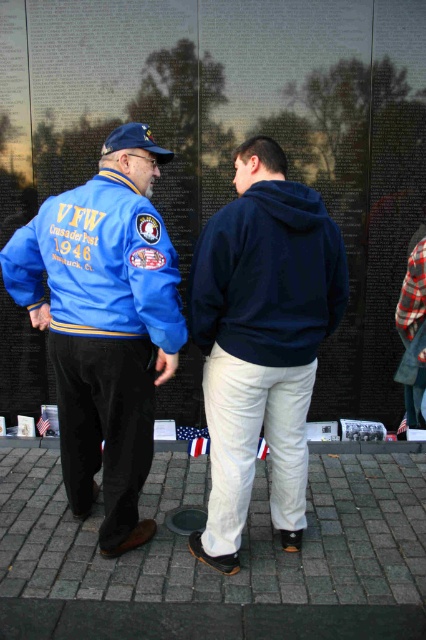
Question: Which point is farther from the camera taking this photo?

Choices:
 (A) (229, 346)
 (B) (45, 429)
 (C) (400, 424)

Answer: (B)

Question: Which point is farther to the camera?

Choices:
 (A) (144, 132)
 (B) (403, 428)

Answer: (B)

Question: Is blue cotton sweatshirt at center wider than american flag at center?

Choices:
 (A) no
 (B) yes

Answer: (B)

Question: Which is farther from the red fabric flag at center?

Choices:
 (A) blue cotton sweatshirt at center
 (B) blue fabric baseball cap at left
 (C) navy fleece hoodie at center

Answer: (B)

Question: Can you confirm if blue leather jacket at left is positioned below blue cotton sweatshirt at center?

Choices:
 (A) no
 (B) yes

Answer: (B)

Question: Is blue leather jacket at left above american flag fabric at center?

Choices:
 (A) yes
 (B) no

Answer: (A)